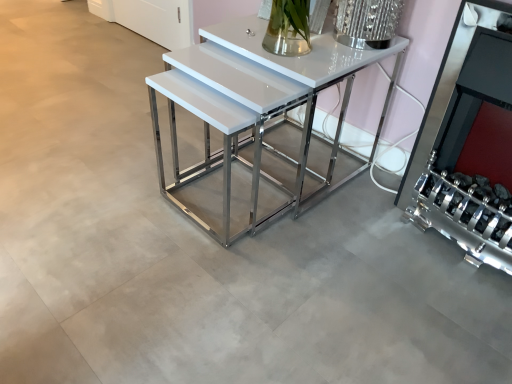
Where is `vacant space that is to the left of white glossy table at center`? vacant space that is to the left of white glossy table at center is located at coordinates (120, 165).